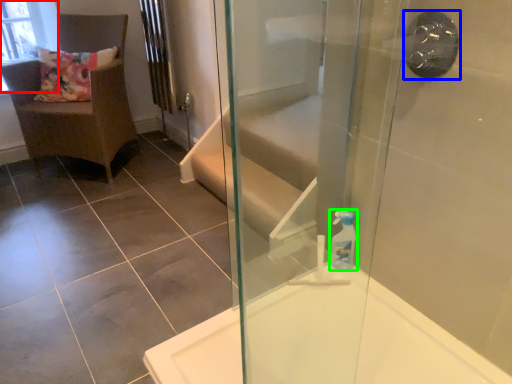
Question: Which object is positioned closest to window screen (highlighted by a red box)? Select from shower (highlighted by a blue box) and soap dispenser (highlighted by a green box).

Choices:
 (A) shower
 (B) soap dispenser

Answer: (B)